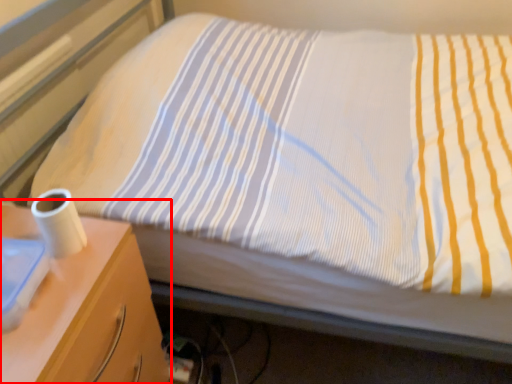
Question: Considering the relative positions of nightstand (annotated by the red box) and toilet paper in the image provided, where is nightstand (annotated by the red box) located with respect to the staircase?

Choices:
 (A) left
 (B) right

Answer: (A)